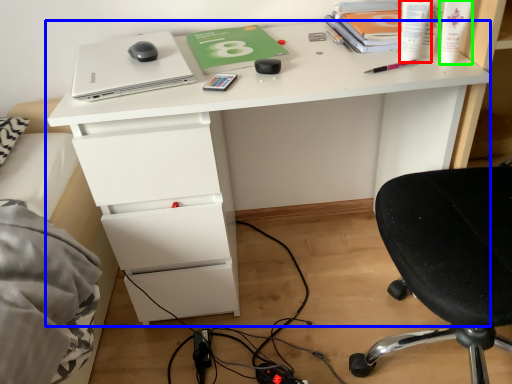
Question: Estimate the real-world distances between objects in this image. Which object is closer to stationery (highlighted by a red box), desk (highlighted by a blue box) or toiletry (highlighted by a green box)?

Choices:
 (A) desk
 (B) toiletry

Answer: (B)